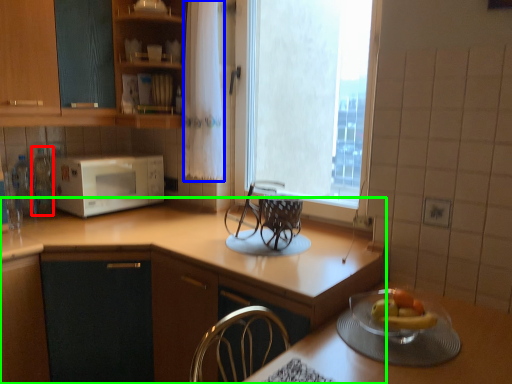
Question: Which object is the farthest from bottle (highlighted by a red box)? Choose among these: curtain (highlighted by a blue box) or countertop (highlighted by a green box).

Choices:
 (A) curtain
 (B) countertop

Answer: (B)